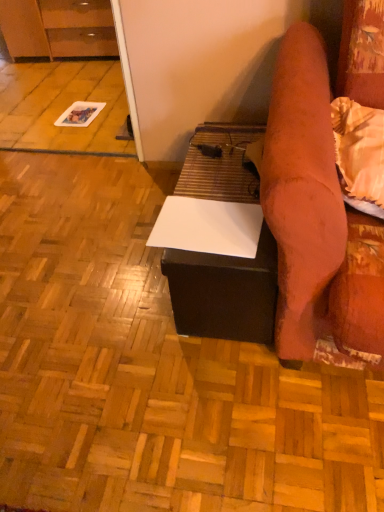
Question: Is white matte paper at center positioned behind white matte table at center?

Choices:
 (A) no
 (B) yes

Answer: (A)

Question: From the image's perspective, is white matte paper at center on white matte table at center?

Choices:
 (A) yes
 (B) no

Answer: (B)

Question: Does white matte paper at center appear on the left side of white matte table at center?

Choices:
 (A) no
 (B) yes

Answer: (B)

Question: Is white matte paper at center facing towards white matte table at center?

Choices:
 (A) yes
 (B) no

Answer: (B)

Question: Is white matte paper at center at the right side of white matte table at center?

Choices:
 (A) yes
 (B) no

Answer: (B)

Question: Can you see white matte paper at center touching white matte table at center?

Choices:
 (A) yes
 (B) no

Answer: (B)

Question: From the image's perspective, would you say white matte table at center is shown under white matte paper at center?

Choices:
 (A) no
 (B) yes

Answer: (A)

Question: Does white matte table at center have a lesser width compared to white matte paper at center?

Choices:
 (A) no
 (B) yes

Answer: (B)

Question: Does white matte table at center contain white matte paper at center?

Choices:
 (A) no
 (B) yes

Answer: (A)

Question: Is white matte table at center bigger than white matte paper at center?

Choices:
 (A) yes
 (B) no

Answer: (B)

Question: Can we say white matte table at center lies outside white matte paper at center?

Choices:
 (A) yes
 (B) no

Answer: (A)

Question: From a real-world perspective, does white matte table at center sit lower than white matte paper at center?

Choices:
 (A) no
 (B) yes

Answer: (A)

Question: Is matte brown cabinet at upper left far away from white matte table at center?

Choices:
 (A) no
 (B) yes

Answer: (B)